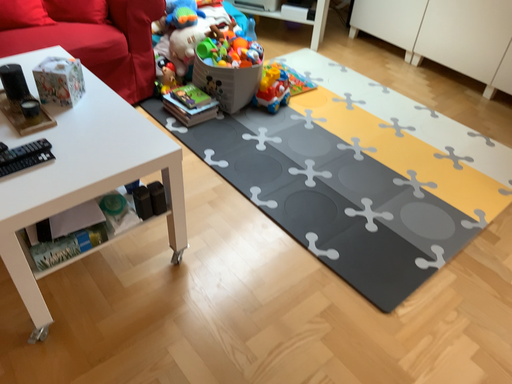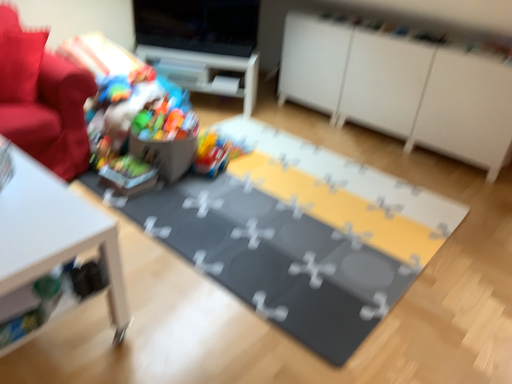
Question: How did the camera likely rotate when shooting the video?

Choices:
 (A) rotated right
 (B) rotated left

Answer: (A)